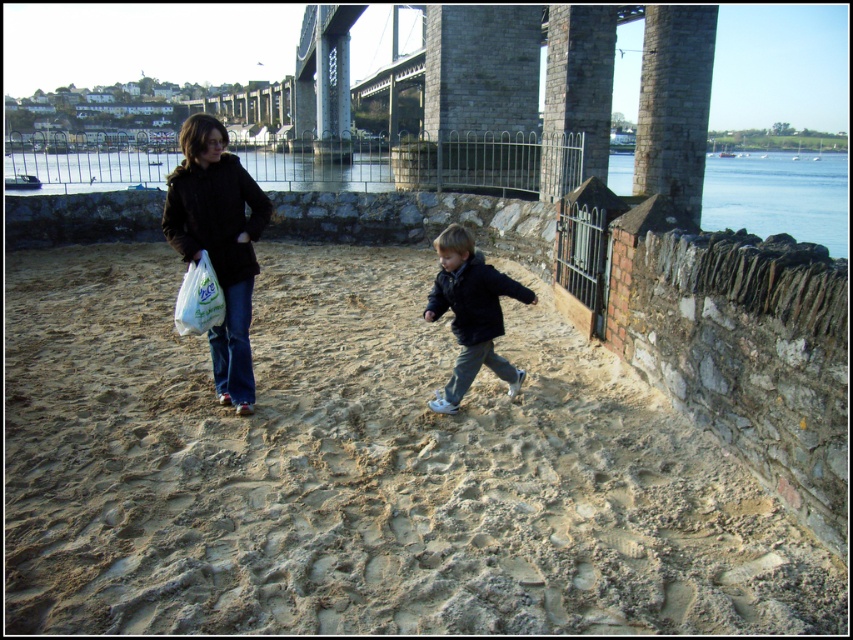
Does stone bridge at upper center appear on the left side of black matte jacket at center?

Indeed, stone bridge at upper center is positioned on the left side of black matte jacket at center.

Find the location of a particular element. This screenshot has height=640, width=853. stone bridge at upper center is located at coordinates (503, 97).

What are the coordinates of `stone bridge at upper center` in the screenshot? It's located at (503, 97).

Can you confirm if brown sandy beach at center is positioned below white plastic bag at center?

Correct, brown sandy beach at center is located below white plastic bag at center.

Who is higher up, brown sandy beach at center or white plastic bag at center?

white plastic bag at center is higher up.

Which is behind, point (825, 563) or point (210, 316)?

Positioned behind is point (210, 316).

Image resolution: width=853 pixels, height=640 pixels. What are the coordinates of `brown sandy beach at center` in the screenshot? It's located at (363, 470).

The image size is (853, 640). I want to click on matte black jacket at left, so click(x=219, y=243).

Is point (247, 344) positioned after point (477, 323)?

That is True.

Between point (206, 154) and point (490, 284), which one is positioned behind?

Point (490, 284)

The width and height of the screenshot is (853, 640). I want to click on matte black jacket at left, so click(x=219, y=243).